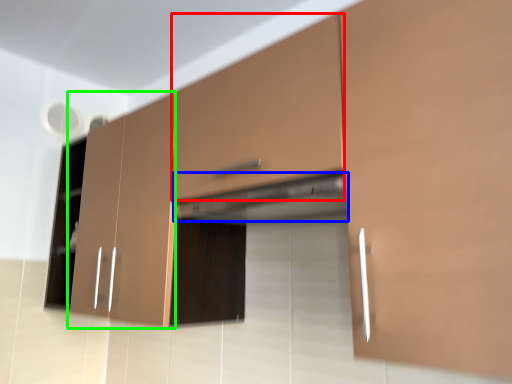
Question: Which object is the farthest from drawer (highlighted by a red box)? Choose among these: exhaust hood (highlighted by a blue box) or cabinetry (highlighted by a green box).

Choices:
 (A) exhaust hood
 (B) cabinetry

Answer: (B)